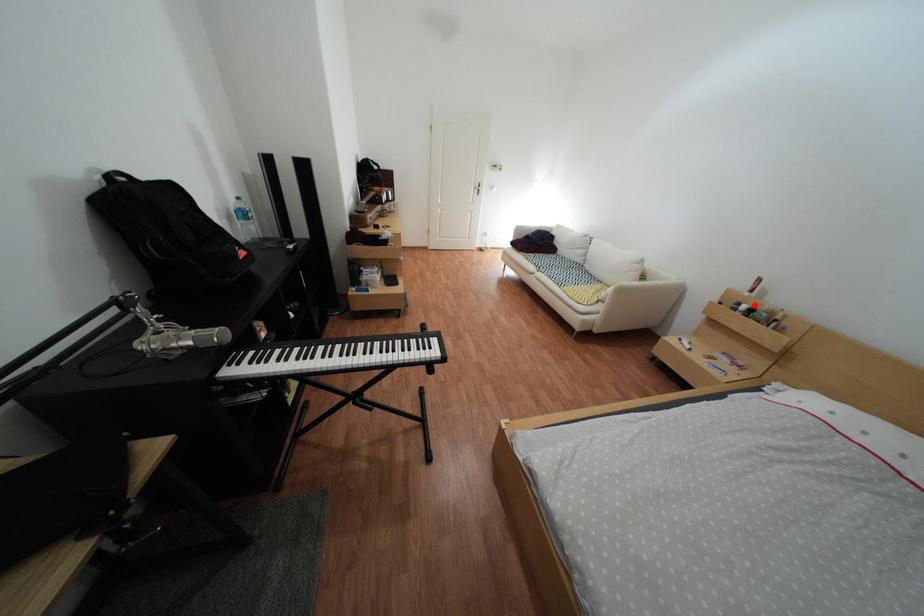
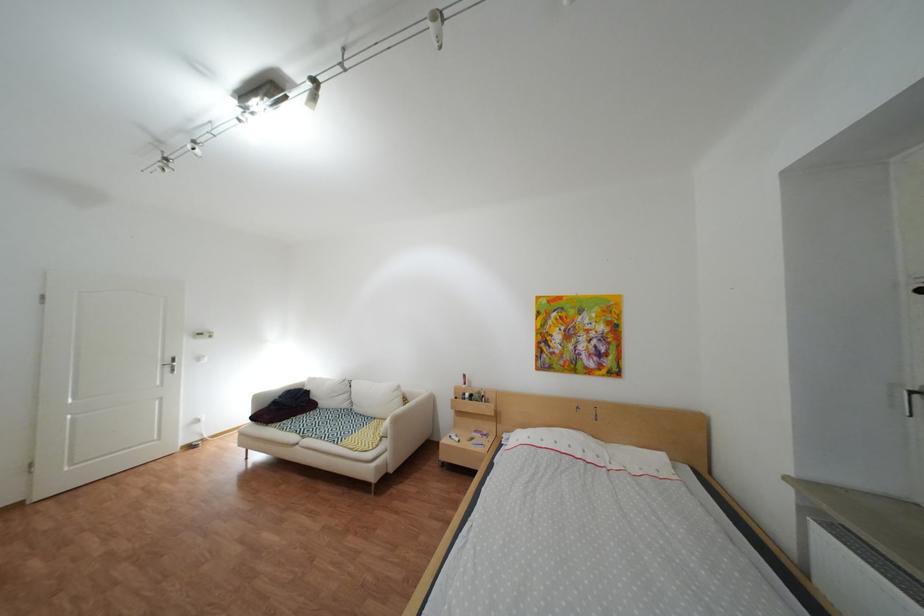
Question: I am providing you with two images of the same scene from different viewpoints. In image1, a red point is highlighted. Considering the same 3D point in image2, which of the following is correct?

Choices:
 (A) It is closer
 (B) It is farther

Answer: (B)